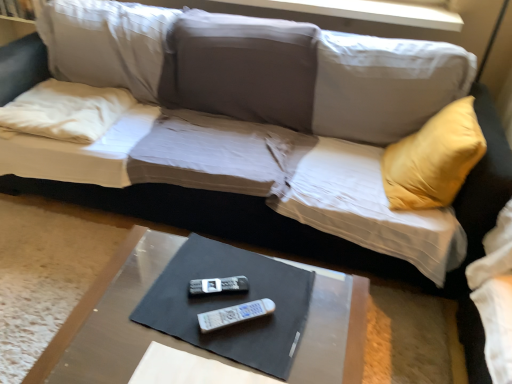
The image size is (512, 384). I want to click on vacant space that is to the left of black plastic remote at center, the second remote when ordered from bottom to top, so click(164, 285).